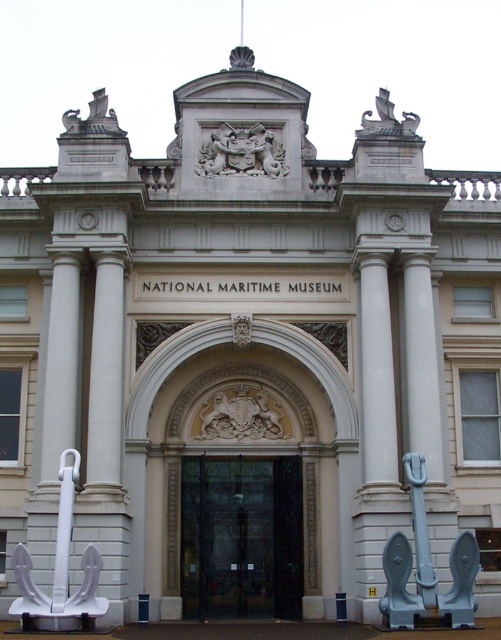
You are standing at the entrance of the National Maritime Museum. You see a point labeled as point (241, 538). What object does this point correspond to?

The point corresponds to the black glass door at center.

You are an architect planning to install a new lighting system for the National Maritime Museum entrance. The white matte anchor at lower left and the carved stone coat of arms at center are both key features requiring illumination. Given that the minimum distance required between two light fixtures to avoid overlapping glare is 100 feet, can you safely install separate fixtures for each feature?

The white matte anchor at lower left is 101.53 feet from the carved stone coat of arms at center. Since the distance exceeds the 100 feet minimum requirement, you can safely install separate fixtures without overlapping glare.

You are a tour guide explaining the entrance of the National Maritime Museum to visitors. You point out the light blue metallic anchor at right and the bronze ship at upper center. Which object would you describe as being bigger?

The light blue metallic anchor at right is larger in size than the bronze ship at upper center, so the light blue metallic anchor at right is bigger.